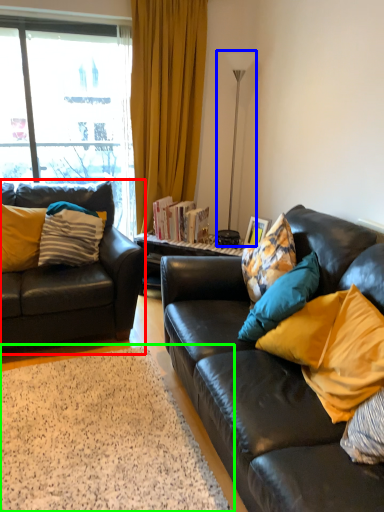
Question: Which is nearer to the studio couch (highlighted by a red box)? lamp (highlighted by a blue box) or flat (highlighted by a green box).

Choices:
 (A) lamp
 (B) flat

Answer: (B)